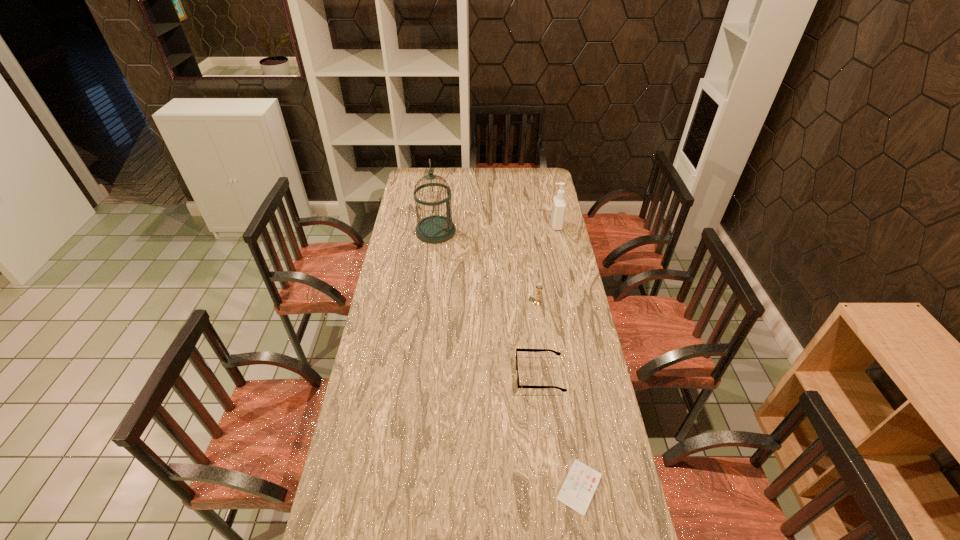
Where is `free region located on the front label of the cleansing agent`? Image resolution: width=960 pixels, height=540 pixels. free region located on the front label of the cleansing agent is located at coordinates (539, 225).

At what (x,y) coordinates should I click in order to perform the action: click on free space located on the front label of the cleansing agent. Please return your answer as a coordinate pair (x, y). The width and height of the screenshot is (960, 540). Looking at the image, I should click on (514, 225).

Locate an element on the screen. Image resolution: width=960 pixels, height=540 pixels. vacant space located on the front label of the cleansing agent is located at coordinates (494, 225).

Where is `free space located on the front of the third tallest object`? free space located on the front of the third tallest object is located at coordinates (547, 378).

Locate an element on the screen. vacant region located on the arms of the second shortest object is located at coordinates (484, 376).

Locate an element on the screen. vacant space situated on the arms of the second shortest object is located at coordinates point(481,376).

The height and width of the screenshot is (540, 960). Identify the location of vacant space located 0.400m on the arms of the second shortest object. (408, 376).

Locate an element on the screen. This screenshot has height=540, width=960. vacant space located 0.300m on the left of the shortest object is located at coordinates (457, 487).

Where is `object present at the left edge`? This screenshot has width=960, height=540. object present at the left edge is located at coordinates (435, 229).

At what (x,y) coordinates should I click in order to perform the action: click on cleansing agent present at the right edge. Please return your answer as a coordinate pair (x, y). The height and width of the screenshot is (540, 960). Looking at the image, I should click on (559, 204).